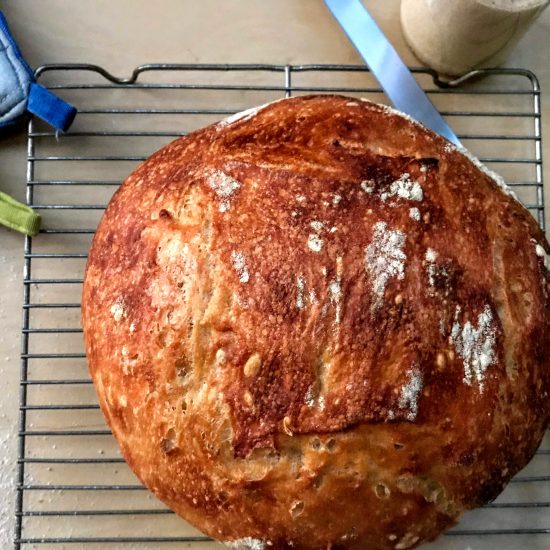
Identify the location of cup. This screenshot has width=550, height=550. (470, 33).